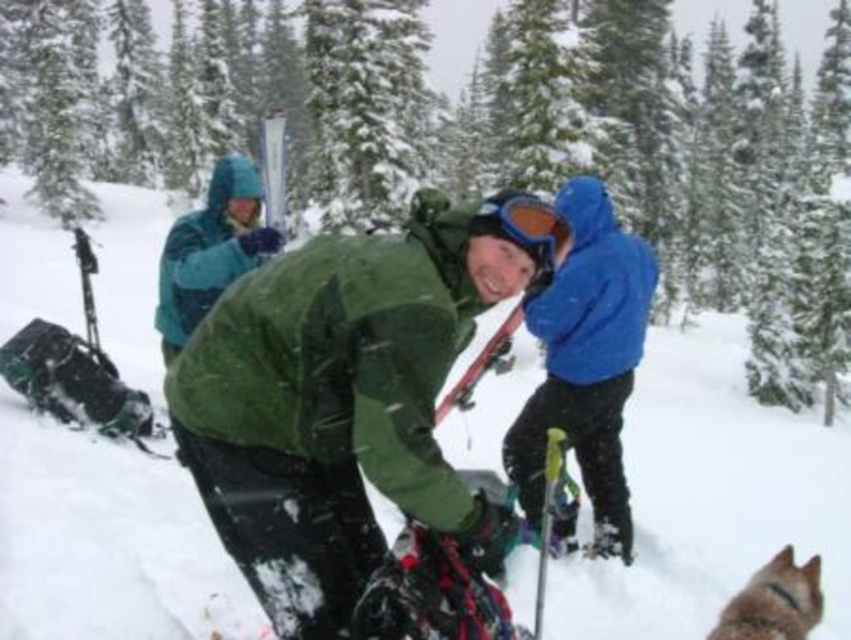
Between white matte snow at center and matte red ski at center, which one has more height?

white matte snow at center is taller.

Image resolution: width=851 pixels, height=640 pixels. In order to click on white matte snow at center in this screenshot , I will do `click(709, 497)`.

Where is `white matte snow at center`? The image size is (851, 640). white matte snow at center is located at coordinates (709, 497).

Between point (566, 296) and point (789, 605), which one is positioned in front?

Positioned in front is point (789, 605).

Is point (603, 252) positioned before point (780, 634)?

No, it is behind (780, 634).

I want to click on blue matte jacket at center, so click(585, 362).

Is point (627, 278) positioned after point (180, 342)?

No.

Is blue matte jacket at center above teal fleece jacket at upper left?

No.

Locate an element on the screen. The width and height of the screenshot is (851, 640). blue matte jacket at center is located at coordinates (585, 362).

Image resolution: width=851 pixels, height=640 pixels. I want to click on blue matte jacket at center, so click(585, 362).